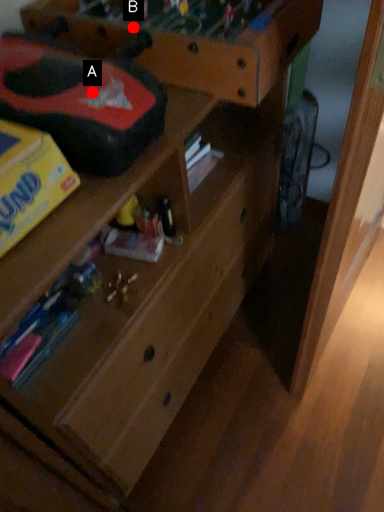
Question: Two points are circled on the image, labeled by A and B beside each circle. Which point is closer to the camera?

Choices:
 (A) A is closer
 (B) B is closer

Answer: (A)